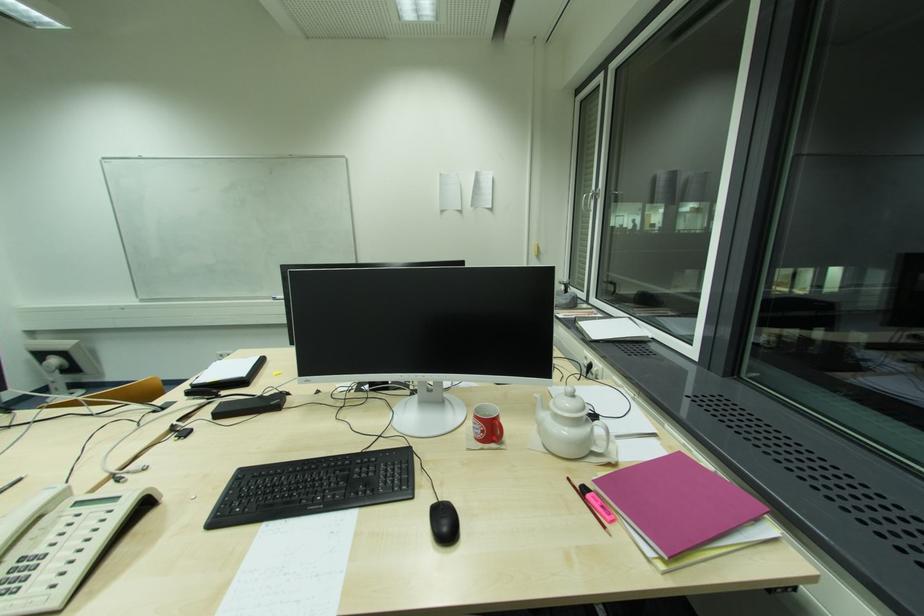
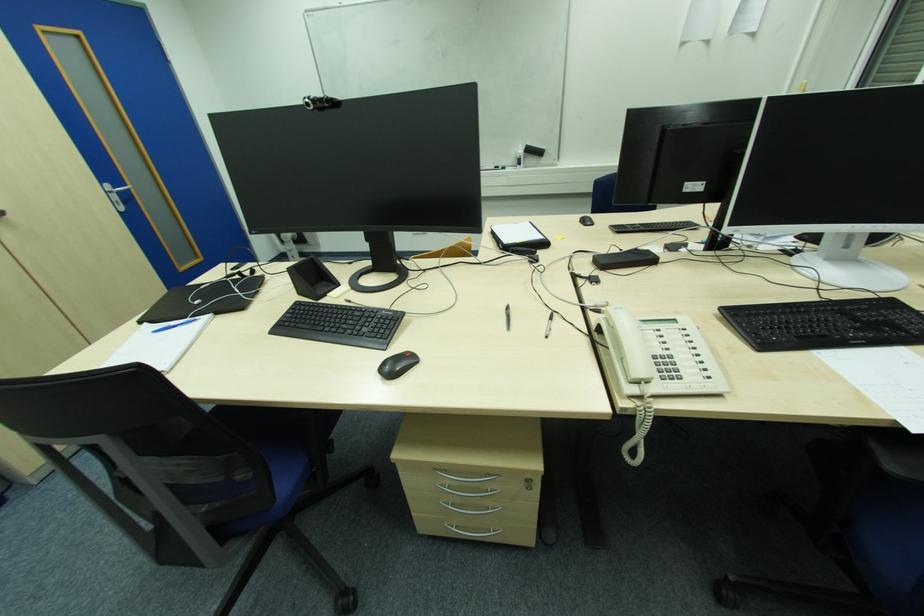
Locate, in the second image, the point that corresponds to point (331, 468) in the first image.

(820, 312)